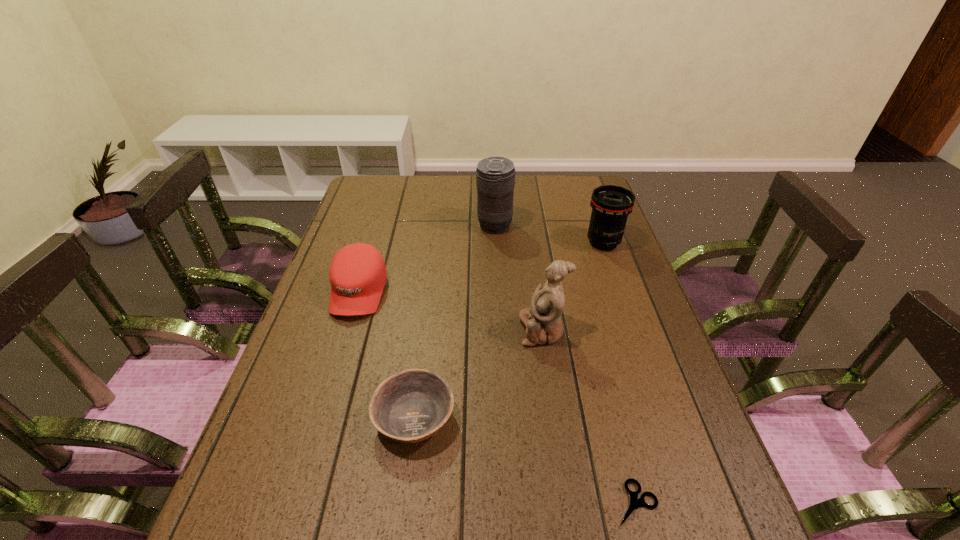
Identify the location of object that is at the left edge. The height and width of the screenshot is (540, 960). (357, 274).

At what (x,y) coordinates should I click in order to perform the action: click on telephoto lens present at the right edge. Please return your answer as a coordinate pair (x, y). The height and width of the screenshot is (540, 960). Looking at the image, I should click on (611, 205).

Locate an element on the screen. The height and width of the screenshot is (540, 960). shears that is at the right edge is located at coordinates (635, 503).

Identify the location of vacant space at the far edge of the desktop. (562, 207).

Where is `vacant region at the left edge of the desktop`? The height and width of the screenshot is (540, 960). vacant region at the left edge of the desktop is located at coordinates (344, 384).

This screenshot has width=960, height=540. I want to click on free space at the right edge of the desktop, so click(679, 376).

Find the location of a particular element. Image resolution: width=960 pixels, height=540 pixels. free space at the near left corner of the desktop is located at coordinates (292, 538).

At what (x,y) coordinates should I click in order to perform the action: click on free area in between the fourth tallest object and the left telephoto lens. Please return your answer as a coordinate pair (x, y). The width and height of the screenshot is (960, 540). Looking at the image, I should click on (426, 259).

Locate an element on the screen. vacant space that is in between the fifth object from left to right and the figurine is located at coordinates (589, 417).

Find the location of a particular element. The image size is (960, 540). vacant area that lies between the taller telephoto lens and the figurine is located at coordinates (518, 278).